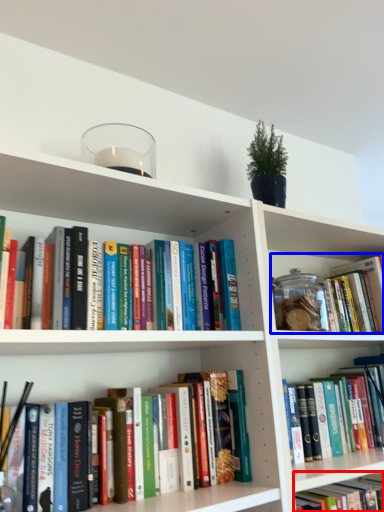
Question: Among these objects, which one is farthest to the camera, book (highlighted by a red box) or book (highlighted by a blue box)?

Choices:
 (A) book
 (B) book

Answer: (B)